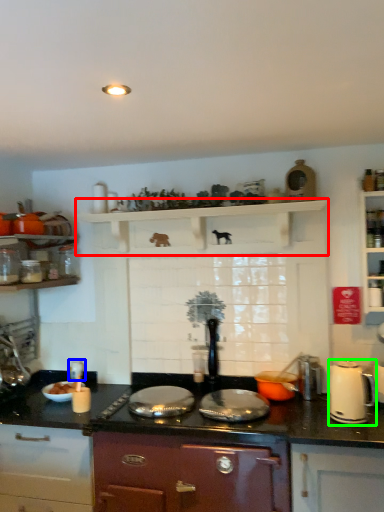
Question: Considering the real-world distances, which object is closest to shelf (highlighted by a red box)? appliance (highlighted by a blue box) or kitchen appliance (highlighted by a green box).

Choices:
 (A) appliance
 (B) kitchen appliance

Answer: (B)